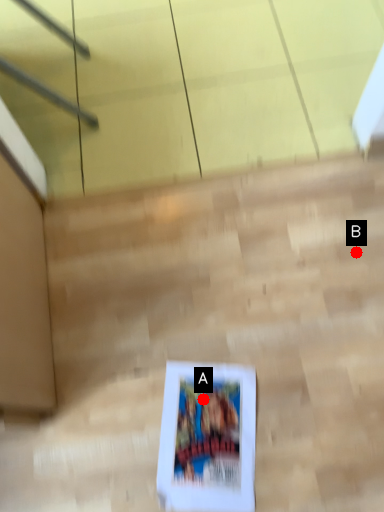
Question: Two points are circled on the image, labeled by A and B beside each circle. Which point is closer to the camera?

Choices:
 (A) A is closer
 (B) B is closer

Answer: (A)